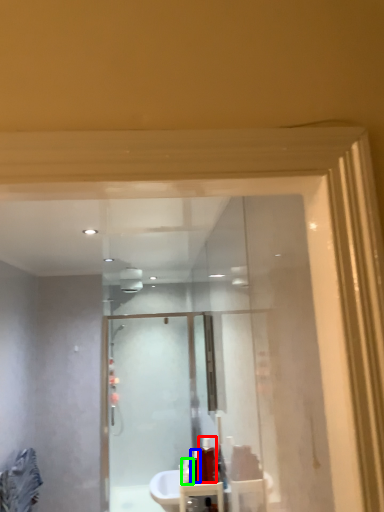
Question: Estimate the real-world distances between objects in this image. Which object is farther from toiletry (highlighted by a red box), toiletry (highlighted by a blue box) or toiletry (highlighted by a green box)?

Choices:
 (A) toiletry
 (B) toiletry

Answer: (B)